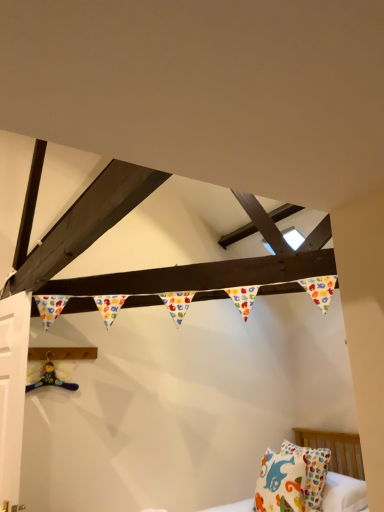
Question: Is multicolored plush toy at lower left oriented away from white matte door at left?

Choices:
 (A) yes
 (B) no

Answer: (B)

Question: Is white matte door at left a part of multicolored plush toy at lower left?

Choices:
 (A) no
 (B) yes

Answer: (A)

Question: Is multicolored plush toy at lower left wider than white matte door at left?

Choices:
 (A) yes
 (B) no

Answer: (B)

Question: From a real-world perspective, is multicolored plush toy at lower left below white matte door at left?

Choices:
 (A) no
 (B) yes

Answer: (A)

Question: Is multicolored plush toy at lower left thinner than white matte door at left?

Choices:
 (A) yes
 (B) no

Answer: (A)

Question: Is multicolored plush toy at lower left taller than white matte door at left?

Choices:
 (A) no
 (B) yes

Answer: (A)

Question: Can you confirm if multicolored plush toy at lower left is wider than white cotton pillow with colorful patterns at lower right?

Choices:
 (A) no
 (B) yes

Answer: (A)

Question: From a real-world perspective, is multicolored plush toy at lower left under white cotton pillow with colorful patterns at lower right?

Choices:
 (A) no
 (B) yes

Answer: (A)

Question: Is multicolored plush toy at lower left looking in the opposite direction of white cotton pillow with colorful patterns at lower right?

Choices:
 (A) yes
 (B) no

Answer: (B)

Question: Is multicolored plush toy at lower left completely or partially outside of white cotton pillow with colorful patterns at lower right?

Choices:
 (A) no
 (B) yes

Answer: (B)

Question: Does multicolored plush toy at lower left appear on the right side of white cotton pillow with colorful patterns at lower right?

Choices:
 (A) yes
 (B) no

Answer: (B)

Question: Can you confirm if multicolored plush toy at lower left is shorter than white cotton pillow with colorful patterns at lower right?

Choices:
 (A) yes
 (B) no

Answer: (A)

Question: From a real-world perspective, is white matte door at left physically below white cotton pillow with colorful patterns at lower right?

Choices:
 (A) no
 (B) yes

Answer: (A)